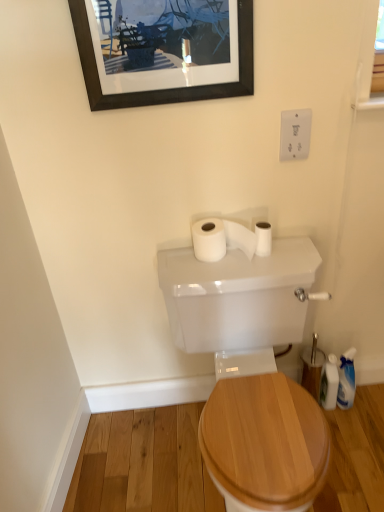
Question: Can you confirm if white plastic bottle at lower right is thinner than white plastic outlet at upper right?

Choices:
 (A) yes
 (B) no

Answer: (B)

Question: Is white plastic bottle at lower right surrounding white plastic outlet at upper right?

Choices:
 (A) yes
 (B) no

Answer: (B)

Question: Is white plastic bottle at lower right outside white plastic outlet at upper right?

Choices:
 (A) yes
 (B) no

Answer: (A)

Question: Is white plastic bottle at lower right to the left of white plastic outlet at upper right from the viewer's perspective?

Choices:
 (A) no
 (B) yes

Answer: (A)

Question: Does white plastic bottle at lower right have a lesser height compared to white plastic outlet at upper right?

Choices:
 (A) no
 (B) yes

Answer: (A)

Question: Is point (119, 5) positioned closer to the camera than point (306, 147)?

Choices:
 (A) farther
 (B) closer

Answer: (B)

Question: From the image's perspective, is black matte picture frame at upper center above or below white plastic outlet at upper right?

Choices:
 (A) below
 (B) above

Answer: (B)

Question: Is black matte picture frame at upper center inside the boundaries of white plastic outlet at upper right, or outside?

Choices:
 (A) outside
 (B) inside

Answer: (A)

Question: Considering the positions of black matte picture frame at upper center and white plastic outlet at upper right in the image, is black matte picture frame at upper center wider or thinner than white plastic outlet at upper right?

Choices:
 (A) wide
 (B) thin

Answer: (A)

Question: Looking at their shapes, would you say white plastic outlet at upper right is wider or thinner than white matte toilet paper at upper center, the second toilet paper in the left-to-right sequence?

Choices:
 (A) thin
 (B) wide

Answer: (A)

Question: Looking at the image, does white plastic outlet at upper right seem bigger or smaller compared to white matte toilet paper at upper center, the second toilet paper in the left-to-right sequence?

Choices:
 (A) big
 (B) small

Answer: (B)

Question: From the image's perspective, is white plastic outlet at upper right located above or below white matte toilet paper at upper center, placed as the 1th toilet paper when sorted from right to left?

Choices:
 (A) above
 (B) below

Answer: (A)

Question: Considering the relative positions of white plastic outlet at upper right and white matte toilet paper at upper center, the second toilet paper in the left-to-right sequence, in the image provided, is white plastic outlet at upper right to the left or to the right of white matte toilet paper at upper center, the second toilet paper in the left-to-right sequence,?

Choices:
 (A) left
 (B) right

Answer: (B)

Question: Is point (327, 385) closer or farther from the camera than point (306, 138)?

Choices:
 (A) closer
 (B) farther

Answer: (B)

Question: Is white plastic bottle at lower right in front of or behind white plastic outlet at upper right in the image?

Choices:
 (A) behind
 (B) front

Answer: (A)